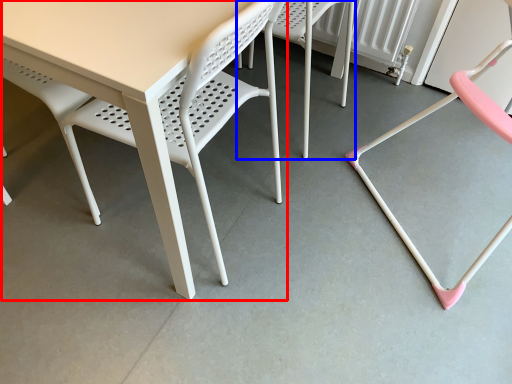
Question: Among these objects, which one is farthest to the camera, table (highlighted by a red box) or chair (highlighted by a blue box)?

Choices:
 (A) table
 (B) chair

Answer: (B)